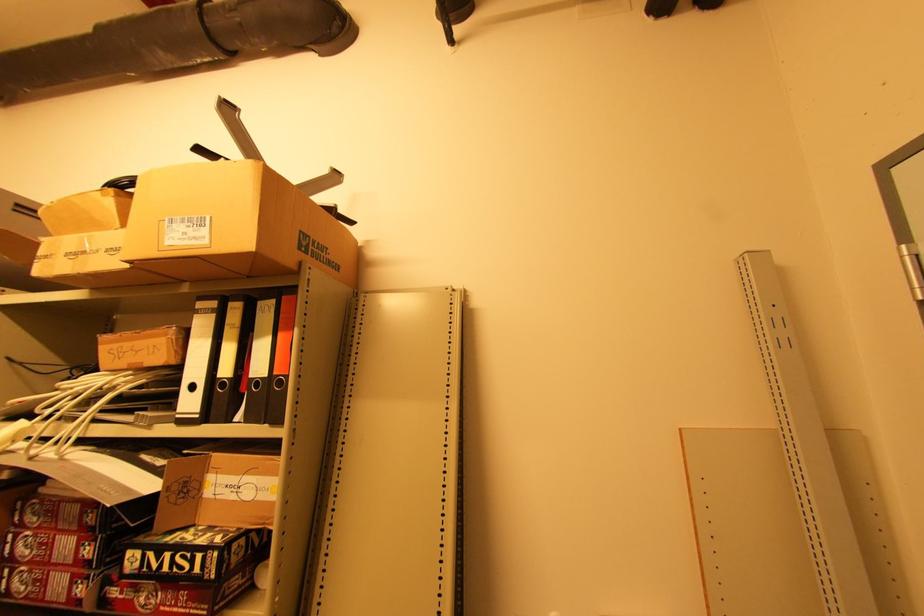
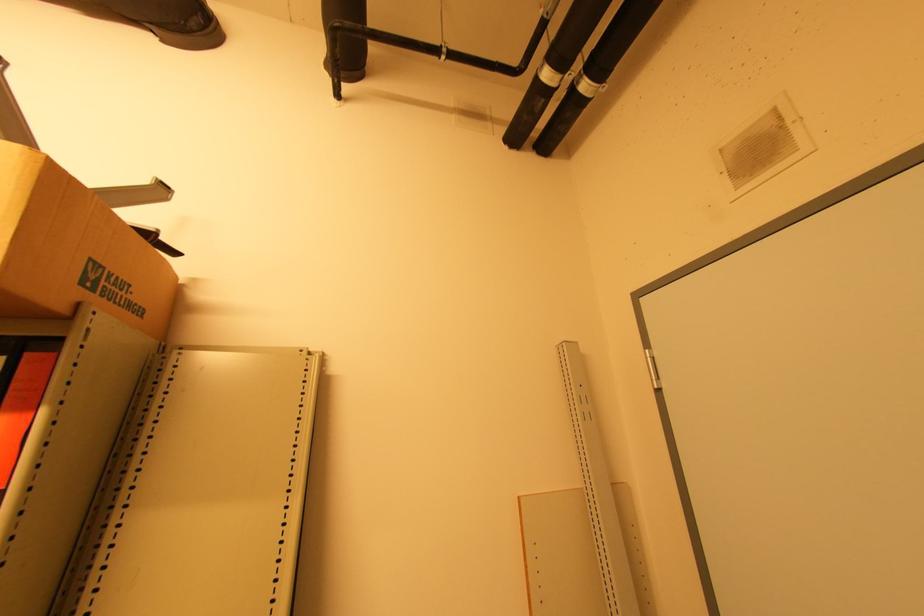
In a continuous first-person perspective shot, in which direction is the camera moving?

The movement direction of the cameraman is left, forward.